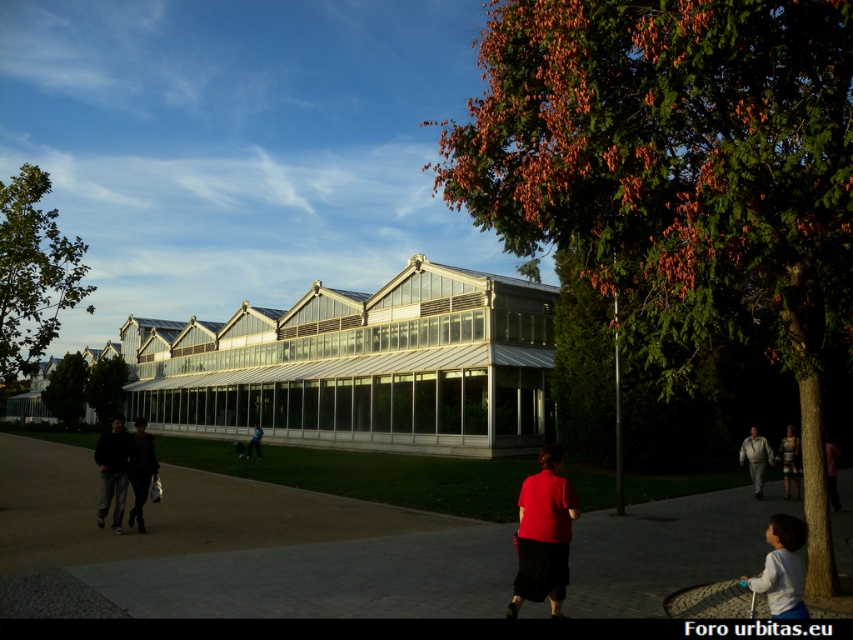
You are standing on the gray concrete path at center and want to see the dark brown leather jacket at left. Which direction should you look to see the jacket?

The gray concrete path at center is not as tall as the dark brown leather jacket at left, so you should look to the left to see the jacket.

You are standing at the entrance of the greenhouse and want to walk to the gray concrete path at center. According to the image, where should you look to find it?

The gray concrete path at center is located at point (245, 547) in the image.

You are standing on the paved pathway in the greenhouse and want to take a photo of the green leafy tree at upper center without the dark brown leather jacket at lower right blocking the view. Is the jacket currently in the way of the tree?

The green leafy tree at upper center is below the dark brown leather jacket at lower right, so the jacket is blocking the view of the tree. You will need to move to a different position to avoid the jacket.